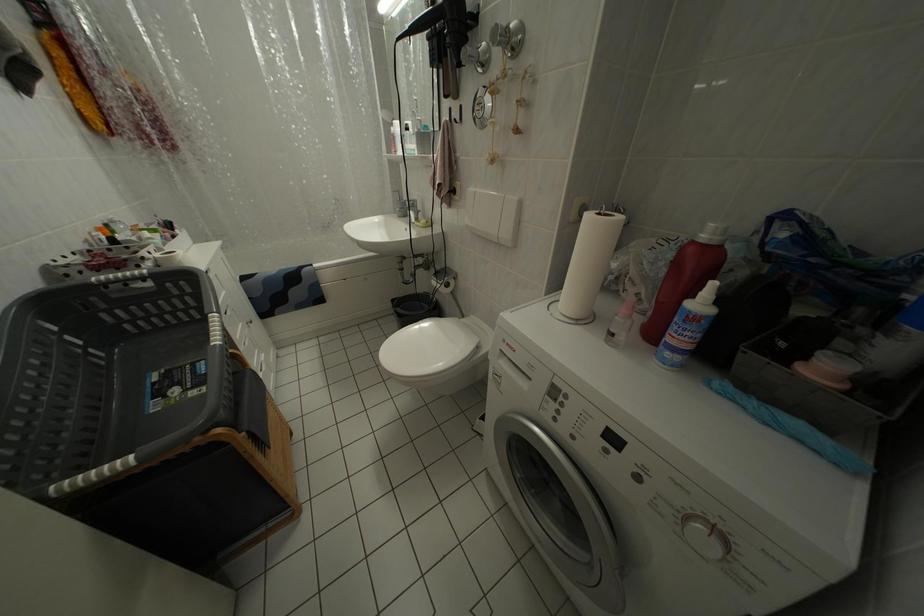
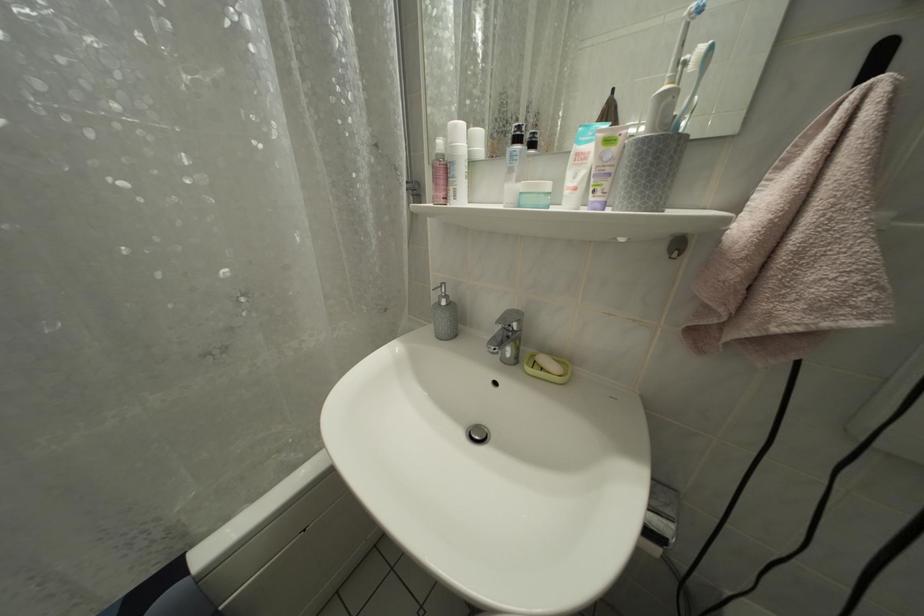
What movement of the cameraman would produce the second image?

The movement direction of the cameraman is left, forward.